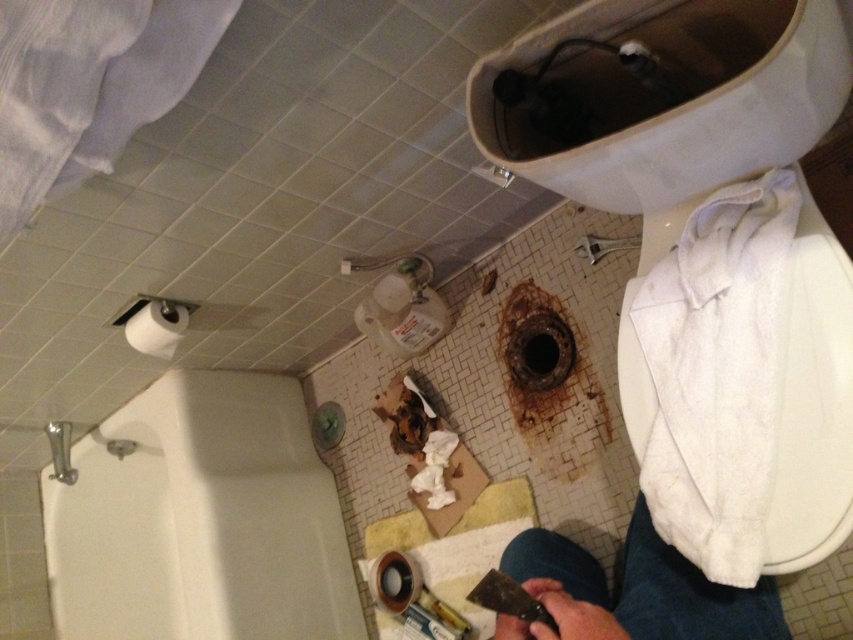
Is point (198, 388) closer to camera compared to point (677, 580)?

That is False.

Does white glossy bathtub at lower left appear on the right side of jeans at lower right?

No, white glossy bathtub at lower left is not to the right of jeans at lower right.

At what (x,y) coordinates should I click in order to perform the action: click on white glossy bathtub at lower left. Please return your answer as a coordinate pair (x, y). The height and width of the screenshot is (640, 853). Looking at the image, I should click on (200, 518).

Is jeans at lower right above white matte toilet paper at upper left?

No, jeans at lower right is not above white matte toilet paper at upper left.

From the picture: Who is more forward, (566,624) or (144,317)?

Positioned in front is point (566,624).

Which is behind, point (654, 554) or point (134, 312)?

Point (134, 312)

I want to click on jeans at lower right, so click(x=633, y=592).

Who is taller, white glossy bathtub at lower left or white matte toilet paper at upper left?

white glossy bathtub at lower left

This screenshot has width=853, height=640. Describe the element at coordinates (200, 518) in the screenshot. I see `white glossy bathtub at lower left` at that location.

Measure the distance between point [99,531] and camera.

They are 5.50 feet apart.

Where is `white glossy bathtub at lower left`? Image resolution: width=853 pixels, height=640 pixels. white glossy bathtub at lower left is located at coordinates (200, 518).